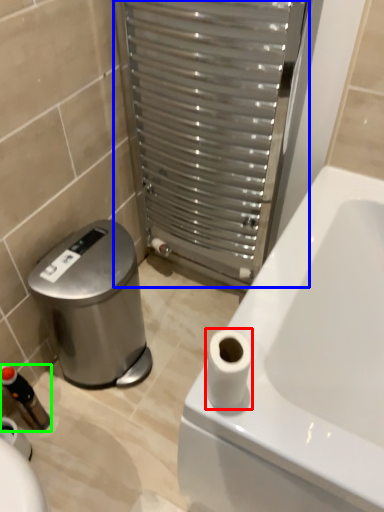
Question: Which object is positioned closest to toilet paper (highlighted by a red box)? Select from screen door (highlighted by a blue box) and toiletry (highlighted by a green box).

Choices:
 (A) screen door
 (B) toiletry

Answer: (A)